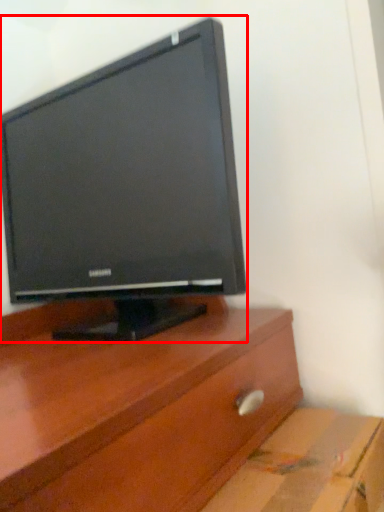
Question: Considering the relative positions of computer monitor (annotated by the red box) and cardboard box in the image provided, where is computer monitor (annotated by the red box) located with respect to the staircase?

Choices:
 (A) left
 (B) right

Answer: (A)